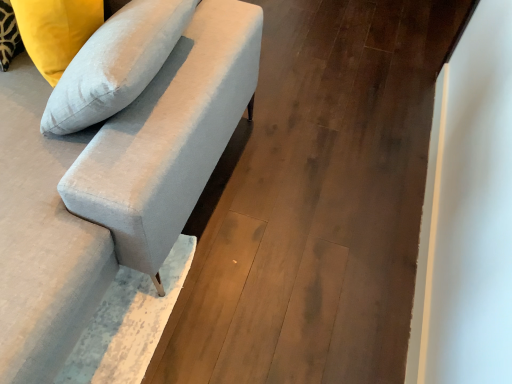
Question: Are satin white pillow at upper left and matte gray sofa at center-left beside each other?

Choices:
 (A) yes
 (B) no

Answer: (B)

Question: Considering the relative sizes of satin white pillow at upper left and matte gray sofa at center-left in the image provided, is satin white pillow at upper left wider than matte gray sofa at center-left?

Choices:
 (A) no
 (B) yes

Answer: (A)

Question: Considering the relative positions of satin white pillow at upper left and matte gray sofa at center-left in the image provided, is satin white pillow at upper left to the right of matte gray sofa at center-left from the viewer's perspective?

Choices:
 (A) no
 (B) yes

Answer: (A)

Question: Could matte gray sofa at center-left be considered to be inside satin white pillow at upper left?

Choices:
 (A) no
 (B) yes

Answer: (A)

Question: From a real-world perspective, is satin white pillow at upper left on top of matte gray sofa at center-left?

Choices:
 (A) no
 (B) yes

Answer: (B)

Question: Is point (68, 61) positioned closer to the camera than point (35, 124)?

Choices:
 (A) closer
 (B) farther

Answer: (B)

Question: Is satin white pillow at upper left in front of or behind suede-like gray couch at upper left in the image?

Choices:
 (A) front
 (B) behind

Answer: (B)

Question: In terms of size, does satin white pillow at upper left appear bigger or smaller than suede-like gray couch at upper left?

Choices:
 (A) big
 (B) small

Answer: (B)

Question: Is satin white pillow at upper left situated inside suede-like gray couch at upper left or outside?

Choices:
 (A) outside
 (B) inside

Answer: (B)

Question: In the image, is satin white pillow at upper left positioned in front of or behind matte gray sofa at center-left?

Choices:
 (A) front
 (B) behind

Answer: (A)

Question: Would you say satin white pillow at upper left is to the left or to the right of matte gray sofa at center-left in the picture?

Choices:
 (A) right
 (B) left

Answer: (B)

Question: Is point (54, 64) positioned closer to the camera than point (449, 3)?

Choices:
 (A) farther
 (B) closer

Answer: (B)

Question: Looking at the image, does satin white pillow at upper left seem bigger or smaller compared to matte gray sofa at center-left?

Choices:
 (A) big
 (B) small

Answer: (B)

Question: Considering the positions of suede-like gray couch at upper left and matte gray sofa at center-left in the image, is suede-like gray couch at upper left taller or shorter than matte gray sofa at center-left?

Choices:
 (A) short
 (B) tall

Answer: (B)

Question: Relative to matte gray sofa at center-left, is suede-like gray couch at upper left in front or behind?

Choices:
 (A) behind
 (B) front

Answer: (B)